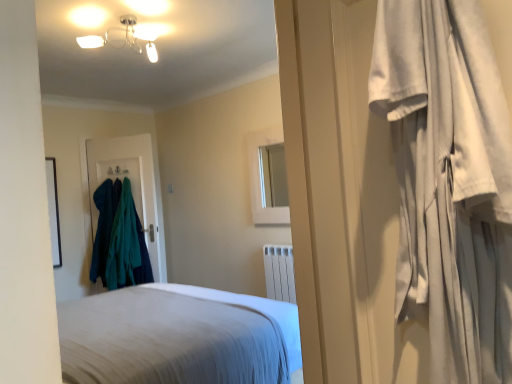
The image size is (512, 384). Identify the location of white soft bed at center, the 1th bed positioned from the front. (178, 337).

Locate an element on the screen. The width and height of the screenshot is (512, 384). green fabric hanger at upper left is located at coordinates (117, 172).

Measure the distance between teal fabric coat hanger at left and camera.

The depth of teal fabric coat hanger at left is 4.30 meters.

How much space does teal woolen sweater at left, acting as the 2th clothing starting from the left, occupy vertically?

It is 1.15 meters.

What do you see at coordinates (103, 229) in the screenshot?
I see `teal fabric coat at left, the 2th clothing viewed from the right` at bounding box center [103, 229].

Find the location of a particular element. The width and height of the screenshot is (512, 384). white glossy medicine cabinet at upper center is located at coordinates (263, 178).

Locate an element on the screen. Image resolution: width=512 pixels, height=384 pixels. white soft bed at center, marked as the second bed in a bottom-to-top arrangement is located at coordinates (178, 337).

From a real-world perspective, which object rests below the other?

In real-world perspective, teal woolen sweater at left, acting as the 2th clothing starting from the left, is lower.

Is teal woolen sweater at left, the first clothing positioned from the right, to the left or to the right of teal fabric coat hanger at left in the image?

Based on their positions, teal woolen sweater at left, the first clothing positioned from the right, is located to the right of teal fabric coat hanger at left.

Looking at this image, is teal woolen sweater at left, the first clothing positioned from the right, bigger than teal fabric coat hanger at left?

Yes.

Considering the sizes of objects teal fabric coat at left, which ranks as the 1th clothing in left-to-right order, and metallic glass chandelier at upper center in the image provided, who is shorter, teal fabric coat at left, which ranks as the 1th clothing in left-to-right order, or metallic glass chandelier at upper center?

metallic glass chandelier at upper center.

Is teal fabric coat at left, which ranks as the 1th clothing in left-to-right order, facing towards metallic glass chandelier at upper center?

No, teal fabric coat at left, which ranks as the 1th clothing in left-to-right order, is not turned towards metallic glass chandelier at upper center.

How much distance is there between teal fabric coat at left, the 2th clothing viewed from the right, and metallic glass chandelier at upper center?

1.86 meters.

Based on their positions, is teal fabric coat at left, which ranks as the 1th clothing in left-to-right order, located to the left or right of metallic glass chandelier at upper center?

In the image, teal fabric coat at left, which ranks as the 1th clothing in left-to-right order, appears on the left side of metallic glass chandelier at upper center.

Considering the relative positions of teal fabric coat hanger at left and green fabric hanger at upper left in the image provided, is teal fabric coat hanger at left to the left or to the right of green fabric hanger at upper left?

teal fabric coat hanger at left is to the right of green fabric hanger at upper left.

Can you confirm if teal fabric coat hanger at left is wider than green fabric hanger at upper left?

In fact, teal fabric coat hanger at left might be narrower than green fabric hanger at upper left.

Based on the photo, are teal fabric coat hanger at left and green fabric hanger at upper left located far from each other?

Actually, teal fabric coat hanger at left and green fabric hanger at upper left are a little close together.

Do you think white glossy medicine cabinet at upper center is within white soft bed at center, the first bed when ordered from back to front, or outside of it?

white glossy medicine cabinet at upper center is spatially situated outside white soft bed at center, the first bed when ordered from back to front.

Considering the positions of objects white glossy medicine cabinet at upper center and white soft bed at center, the 2th bed viewed from the top, in the image provided, who is more to the left, white glossy medicine cabinet at upper center or white soft bed at center, the 2th bed viewed from the top,?

white soft bed at center, the 2th bed viewed from the top, is more to the left.

From the image's perspective, would you say white glossy medicine cabinet at upper center is positioned over white soft bed at center, acting as the 2th bed starting from the front?

Yes, from the image's perspective, white glossy medicine cabinet at upper center is above white soft bed at center, acting as the 2th bed starting from the front.

Are white glossy medicine cabinet at upper center and white soft bed at center, the 1th bed from the bottom, far apart?

white glossy medicine cabinet at upper center is far away from white soft bed at center, the 1th bed from the bottom.

Considering the points (126, 209) and (263, 203), which point is behind, point (126, 209) or point (263, 203)?

Point (126, 209)

From a real-world perspective, is teal woolen sweater at left, the first clothing positioned from the right, physically below white glossy medicine cabinet at upper center?

Yes, from a real-world perspective, teal woolen sweater at left, the first clothing positioned from the right, is beneath white glossy medicine cabinet at upper center.

Identify the location of the 1st clothing behind the white glossy medicine cabinet at upper center. The height and width of the screenshot is (384, 512). [x=127, y=246].

Is white glossy medicine cabinet at upper center at the back of white soft bed at center, the 1th bed from the bottom?

No, white glossy medicine cabinet at upper center is not at the back of white soft bed at center, the 1th bed from the bottom.

From the picture: From the image's perspective, does white soft bed at center, the 2th bed viewed from the top, appear higher than white glossy medicine cabinet at upper center?

No, from the image's perspective, white soft bed at center, the 2th bed viewed from the top, is not over white glossy medicine cabinet at upper center.

From a real-world perspective, does white soft bed at center, the 1th bed from the bottom, stand above white glossy medicine cabinet at upper center?

No, from a real-world perspective, white soft bed at center, the 1th bed from the bottom, is not on top of white glossy medicine cabinet at upper center.

In the scene shown: From the image's perspective, which object appears higher, teal woolen sweater at left, the first clothing positioned from the right, or green fabric hanger at upper left?

green fabric hanger at upper left is shown above in the image.

How many degrees apart are the facing directions of teal woolen sweater at left, the first clothing positioned from the right, and green fabric hanger at upper left?

0.000197 degrees.

Visually, is teal woolen sweater at left, the first clothing positioned from the right, positioned to the left or to the right of green fabric hanger at upper left?

From the image, it's evident that teal woolen sweater at left, the first clothing positioned from the right, is to the right of green fabric hanger at upper left.

Is teal woolen sweater at left, acting as the 2th clothing starting from the left, closer to the viewer compared to green fabric hanger at upper left?

Yes, teal woolen sweater at left, acting as the 2th clothing starting from the left, is in front of green fabric hanger at upper left.

Locate an element on the screen. door above the teal woolen sweater at left, acting as the 2th clothing starting from the left (from a real-world perspective) is located at coordinates (131, 185).

Where is `lamp to the right of teal fabric coat at left, the 2th clothing viewed from the right`? This screenshot has width=512, height=384. lamp to the right of teal fabric coat at left, the 2th clothing viewed from the right is located at coordinates (125, 37).

Estimate the real-world distances between objects in this image. Which object is closer to teal fabric coat hanger at left, white cotton curtain at right or teal woolen sweater at left, the first clothing positioned from the right?

teal woolen sweater at left, the first clothing positioned from the right.

When comparing their distances from green fabric hanger at upper left, does teal fabric coat at left, the 2th clothing viewed from the right, or teal woolen sweater at left, acting as the 2th clothing starting from the left, seem further?

teal woolen sweater at left, acting as the 2th clothing starting from the left.

Based on their spatial positions, is white soft bed at center, the 2th bed viewed from the top, or green fabric hanger at upper left further from white soft bed at center, the 1th bed positioned from the front?

green fabric hanger at upper left is positioned further to the anchor white soft bed at center, the 1th bed positioned from the front.

Considering their positions, is metallic glass chandelier at upper center positioned closer to teal woolen sweater at left, the first clothing positioned from the right, than white cotton curtain at right?

metallic glass chandelier at upper center is positioned closer to the anchor teal woolen sweater at left, the first clothing positioned from the right.

Looking at the image, which one is located further to green fabric hanger at upper left, white soft bed at center, the 2th bed viewed from the top, or white glossy medicine cabinet at upper center?

white soft bed at center, the 2th bed viewed from the top, is further to green fabric hanger at upper left.

Which object lies further to the anchor point metallic glass chandelier at upper center, green fabric hanger at upper left or white soft bed at center, acting as the first bed starting from the top?

white soft bed at center, acting as the first bed starting from the top, is positioned further to the anchor metallic glass chandelier at upper center.

Which object lies nearer to the anchor point metallic glass chandelier at upper center, white soft bed at center, marked as the second bed in a bottom-to-top arrangement, or teal fabric coat hanger at left?

teal fabric coat hanger at left lies closer to metallic glass chandelier at upper center than the other object.

Which object lies further to the anchor point teal fabric coat at left, the 2th clothing viewed from the right, teal fabric coat hanger at left or white cotton curtain at right?

white cotton curtain at right lies further to teal fabric coat at left, the 2th clothing viewed from the right, than the other object.

Find the location of a particular element. clothing between green fabric hanger at upper left and teal woolen sweater at left, the first clothing positioned from the right, vertically is located at coordinates (103, 229).

The width and height of the screenshot is (512, 384). I want to click on clothing located between white cotton curtain at right and teal fabric coat at left, the 2th clothing viewed from the right, in the depth direction, so click(x=127, y=246).

You are a GUI agent. You are given a task and a screenshot of the screen. Output one action in this format:
    pyautogui.click(x=<x>, y=<y>)
    Task: Click on the door located between teal fabric coat at left, the 2th clothing viewed from the right, and teal woolen sweater at left, the first clothing positioned from the right, in the left-right direction
    Image resolution: width=512 pixels, height=384 pixels.
    Given the screenshot: What is the action you would take?
    pyautogui.click(x=131, y=185)

The width and height of the screenshot is (512, 384). I want to click on medicine cabinet between metallic glass chandelier at upper center and teal fabric coat at left, the 2th clothing viewed from the right, in the front-back direction, so click(263, 178).